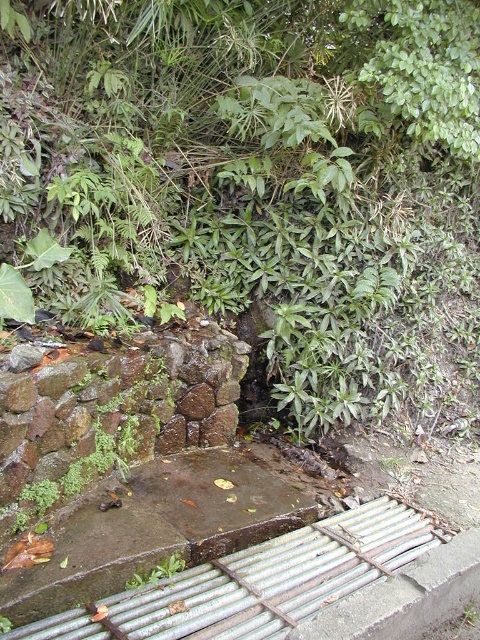
You are planning to place a new small garden ornament between the green leafy tree at center and the green leafy plant at lower left. Considering their sizes, which one should you position closer to the ornament to ensure it doesn

The green leafy plant at lower left is smaller than the green leafy tree at center, so positioning the ornament closer to the tree would create a balanced arrangement where the ornament is flanked by both plants without being overshadowed by the larger tree.

You are standing near the water feature and want to place a small statue between the green leafy tree at center and the green leafy plant at lower left. Based on their positions, where should you place the statue so it is between them?

The green leafy tree at center is positioned over the green leafy plant at lower left, so you should place the statue below the green leafy tree at center and above the green leafy plant at lower left to position it between them.